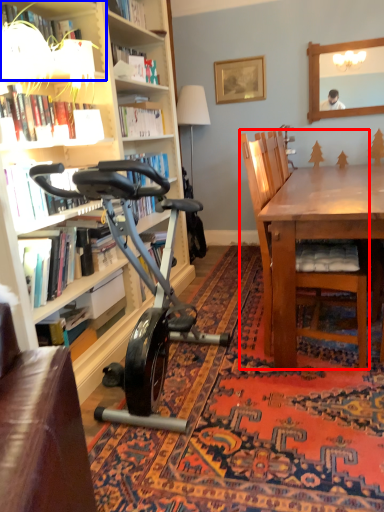
Question: Which object is further to the camera taking this photo, chair (highlighted by a red box) or shelf (highlighted by a blue box)?

Choices:
 (A) chair
 (B) shelf

Answer: (A)